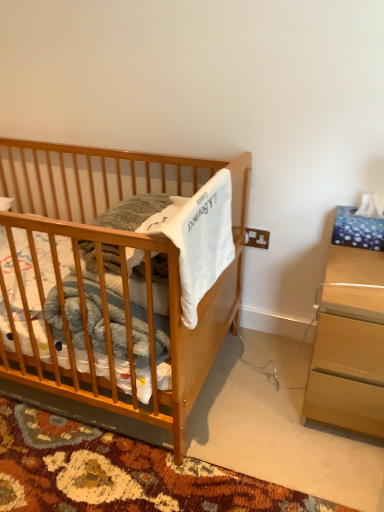
Question: Considering the positions of light brown wood nightstand at right and light brown wooden crib at left in the image, is light brown wood nightstand at right bigger or smaller than light brown wooden crib at left?

Choices:
 (A) small
 (B) big

Answer: (A)

Question: Choose the correct answer: Is light brown wood nightstand at right inside light brown wooden crib at left or outside it?

Choices:
 (A) inside
 (B) outside

Answer: (B)

Question: Is light brown wood nightstand at right wider or thinner than light brown wooden crib at left?

Choices:
 (A) thin
 (B) wide

Answer: (A)

Question: From a real-world perspective, is light brown wooden crib at left above or below light brown wood nightstand at right?

Choices:
 (A) above
 (B) below

Answer: (A)

Question: Considering their positions, is light brown wooden crib at left located in front of or behind light brown wood nightstand at right?

Choices:
 (A) behind
 (B) front

Answer: (B)

Question: Based on their sizes in the image, would you say light brown wooden crib at left is bigger or smaller than light brown wood nightstand at right?

Choices:
 (A) small
 (B) big

Answer: (B)

Question: Considering the relative positions of light brown wooden crib at left and light brown wood nightstand at right in the image provided, is light brown wooden crib at left to the left or to the right of light brown wood nightstand at right?

Choices:
 (A) left
 (B) right

Answer: (A)